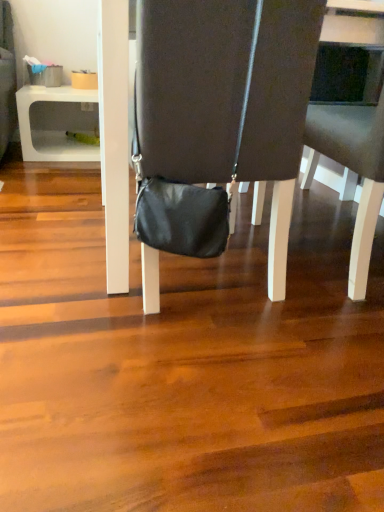
Question: Does dark gray fabric chair at center, acting as the 2th chair starting from the left, come behind white plastic table at lower left?

Choices:
 (A) no
 (B) yes

Answer: (A)

Question: Is dark gray fabric chair at center, acting as the 2th chair starting from the left, positioned in front of white plastic table at lower left?

Choices:
 (A) yes
 (B) no

Answer: (A)

Question: Could you tell me if dark gray fabric chair at center, acting as the 2th chair starting from the left, is turned towards white plastic table at lower left?

Choices:
 (A) yes
 (B) no

Answer: (B)

Question: Does dark gray fabric chair at center, acting as the 2th chair starting from the left, have a greater width compared to white plastic table at lower left?

Choices:
 (A) no
 (B) yes

Answer: (A)

Question: From a real-world perspective, is dark gray fabric chair at center, acting as the 2th chair starting from the left, positioned over white plastic table at lower left based on gravity?

Choices:
 (A) no
 (B) yes

Answer: (B)

Question: From their relative heights in the image, would you say dark gray fabric chair at center, the first chair from the right, is taller or shorter than white plastic table at lower left?

Choices:
 (A) short
 (B) tall

Answer: (B)

Question: Does point (317, 159) appear closer or farther from the camera than point (79, 157)?

Choices:
 (A) closer
 (B) farther

Answer: (A)

Question: From a real-world perspective, is dark gray fabric chair at center, the first chair from the right, positioned above or below white plastic table at lower left?

Choices:
 (A) above
 (B) below

Answer: (A)

Question: Is dark gray fabric chair at center, acting as the 2th chair starting from the left, spatially inside white plastic table at lower left, or outside of it?

Choices:
 (A) outside
 (B) inside

Answer: (A)

Question: In terms of width, does white plastic table at lower left look wider or thinner when compared to matte black bag at center, marked as the first chair in a left-to-right arrangement?

Choices:
 (A) wide
 (B) thin

Answer: (A)

Question: In the image, is white plastic table at lower left on the left side or the right side of matte black bag at center, the 2th chair positioned from the right?

Choices:
 (A) right
 (B) left

Answer: (B)

Question: Does point (79, 158) appear closer or farther from the camera than point (208, 70)?

Choices:
 (A) closer
 (B) farther

Answer: (B)

Question: Is white plastic table at lower left taller or shorter than matte black bag at center, marked as the first chair in a left-to-right arrangement?

Choices:
 (A) tall
 (B) short

Answer: (B)

Question: Considering the positions of white plastic table at lower left and dark gray fabric chair at center, acting as the 2th chair starting from the left, in the image, is white plastic table at lower left wider or thinner than dark gray fabric chair at center, acting as the 2th chair starting from the left,?

Choices:
 (A) wide
 (B) thin

Answer: (A)

Question: Is white plastic table at lower left inside the boundaries of dark gray fabric chair at center, the first chair from the right, or outside?

Choices:
 (A) inside
 (B) outside

Answer: (B)